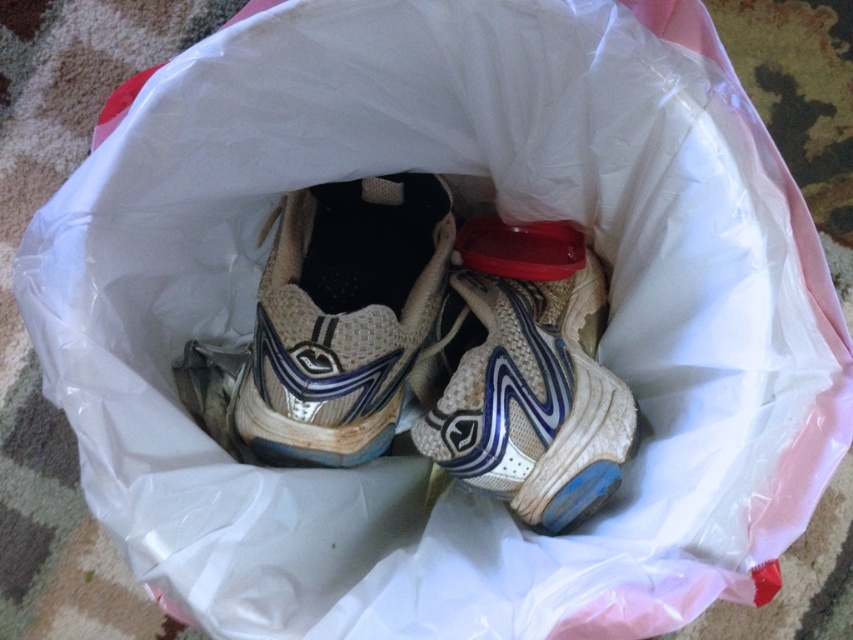
Question: Is worn beige fabric shoe at center below white mesh shoe at center?

Choices:
 (A) yes
 (B) no

Answer: (B)

Question: Which of the following is the closest to the observer?

Choices:
 (A) (473, 364)
 (B) (433, 186)

Answer: (A)

Question: In this image, where is worn beige fabric shoe at center located relative to white mesh shoe at center?

Choices:
 (A) above
 (B) below

Answer: (A)

Question: Observing the image, what is the correct spatial positioning of worn beige fabric shoe at center in reference to white mesh shoe at center?

Choices:
 (A) left
 (B) right

Answer: (A)

Question: Which point appears farthest from the camera in this image?

Choices:
 (A) (422, 448)
 (B) (328, 380)

Answer: (A)